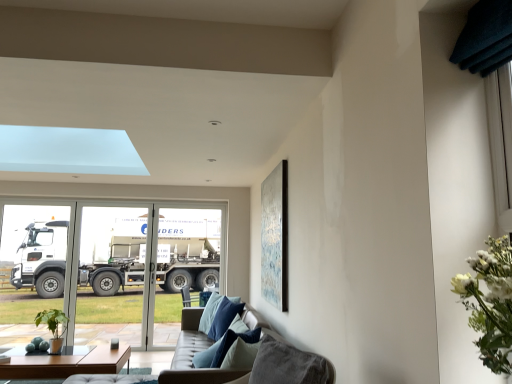
Question: Is transparent glass screen door at left, marked as the 1th screen door in a left-to-right arrangement, positioned beyond the bounds of blue velvet pillow at center?

Choices:
 (A) yes
 (B) no

Answer: (A)

Question: Considering the relative positions of transparent glass screen door at left, marked as the 1th screen door in a left-to-right arrangement, and blue velvet pillow at center in the image provided, is transparent glass screen door at left, marked as the 1th screen door in a left-to-right arrangement, to the left of blue velvet pillow at center from the viewer's perspective?

Choices:
 (A) yes
 (B) no

Answer: (A)

Question: Is transparent glass screen door at left, marked as the 1th screen door in a left-to-right arrangement, wider than blue velvet pillow at center?

Choices:
 (A) yes
 (B) no

Answer: (B)

Question: Considering the relative sizes of transparent glass screen door at left, marked as the 1th screen door in a left-to-right arrangement, and blue velvet pillow at center in the image provided, is transparent glass screen door at left, marked as the 1th screen door in a left-to-right arrangement, thinner than blue velvet pillow at center?

Choices:
 (A) no
 (B) yes

Answer: (B)

Question: Does transparent glass screen door at left, marked as the 1th screen door in a left-to-right arrangement, come in front of blue velvet pillow at center?

Choices:
 (A) yes
 (B) no

Answer: (B)

Question: From the image's perspective, is metallic silver picture frame at upper right above or below transparent glass screen door at left, the second screen door from the right?

Choices:
 (A) above
 (B) below

Answer: (A)

Question: In terms of height, does metallic silver picture frame at upper right look taller or shorter compared to transparent glass screen door at left, marked as the 1th screen door in a left-to-right arrangement?

Choices:
 (A) tall
 (B) short

Answer: (B)

Question: Considering their positions, is metallic silver picture frame at upper right located in front of or behind transparent glass screen door at left, the second screen door from the right?

Choices:
 (A) behind
 (B) front

Answer: (B)

Question: Is metallic silver picture frame at upper right wider or thinner than transparent glass screen door at left, marked as the 1th screen door in a left-to-right arrangement?

Choices:
 (A) wide
 (B) thin

Answer: (B)

Question: Considering the positions of white metallic truck at left and green matte plant at lower left in the image, is white metallic truck at left wider or thinner than green matte plant at lower left?

Choices:
 (A) wide
 (B) thin

Answer: (B)

Question: Considering the positions of white metallic truck at left and green matte plant at lower left in the image, is white metallic truck at left bigger or smaller than green matte plant at lower left?

Choices:
 (A) small
 (B) big

Answer: (B)

Question: Is white metallic truck at left in front of or behind green matte plant at lower left in the image?

Choices:
 (A) behind
 (B) front

Answer: (A)

Question: Is white metallic truck at left spatially inside green matte plant at lower left, or outside of it?

Choices:
 (A) inside
 (B) outside

Answer: (B)

Question: Is matte black coffee table at lower left bigger or smaller than leather couch at lower center?

Choices:
 (A) big
 (B) small

Answer: (B)

Question: Is matte black coffee table at lower left in front of or behind leather couch at lower center in the image?

Choices:
 (A) front
 (B) behind

Answer: (B)